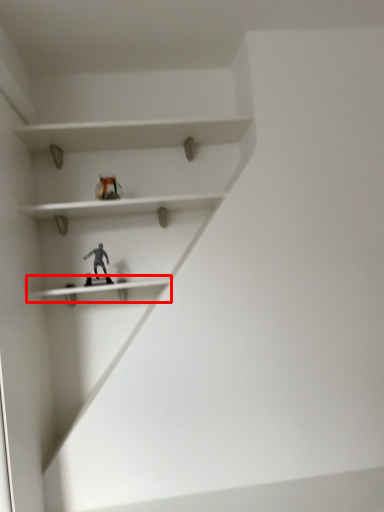
Question: From the image's perspective, where is shelf (annotated by the red box) located in relation to toy in the image?

Choices:
 (A) above
 (B) below

Answer: (B)